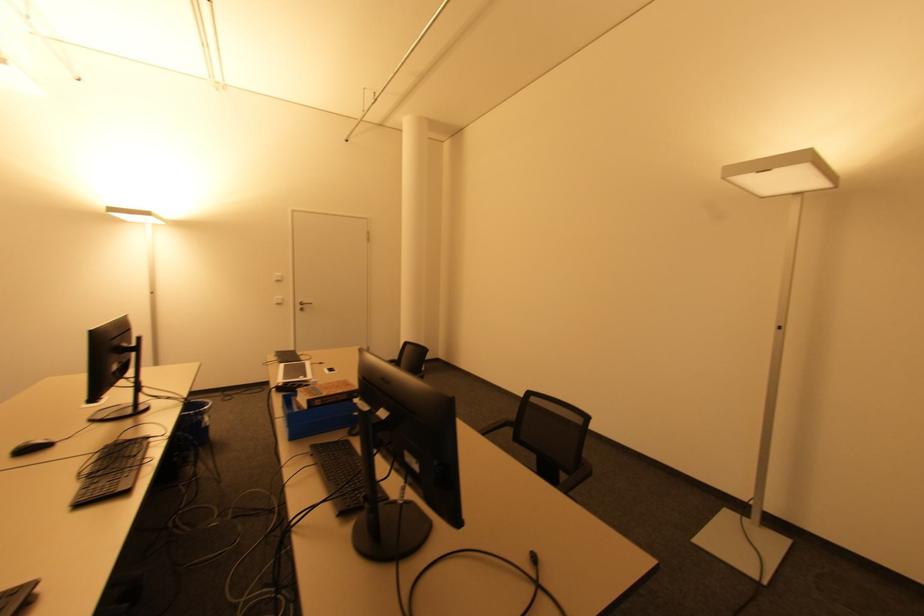
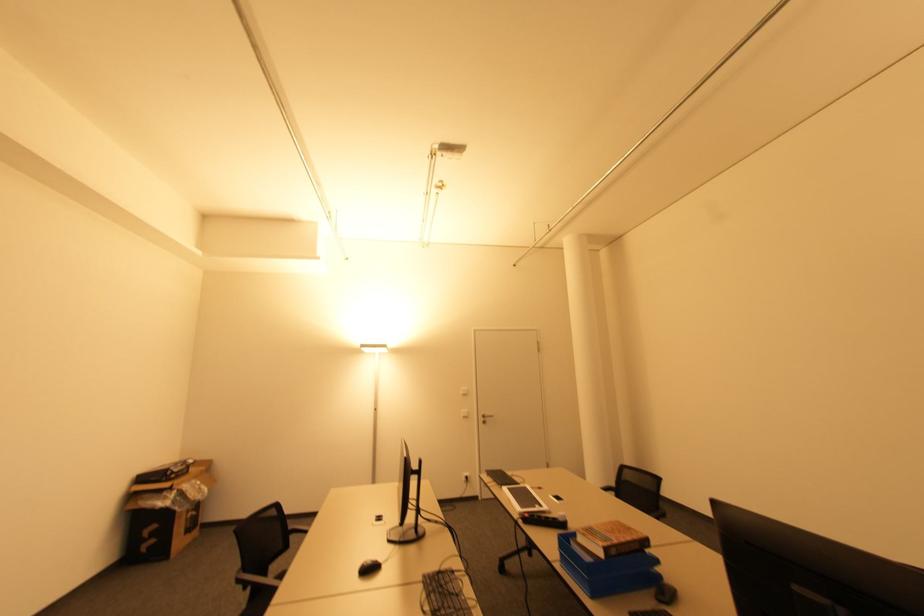
The point at (304, 310) is marked in the first image. Where is the corresponding point in the second image?

(485, 422)